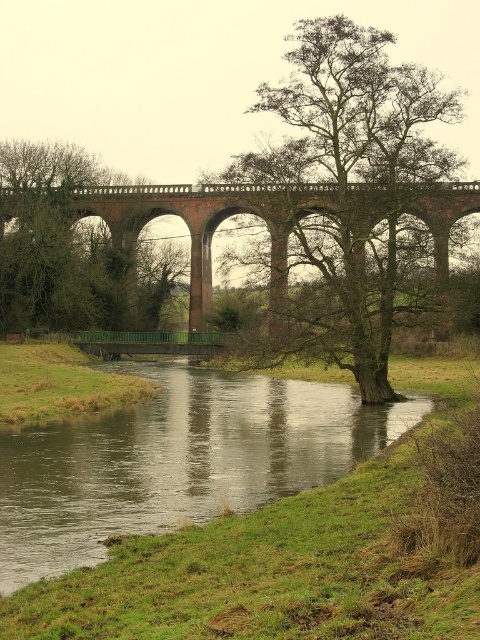
Question: Among these objects, which one is farthest from the camera?

Choices:
 (A) green leafy tree at center
 (B) brick arch bridge at center
 (C) green leafy tree at left
 (D) green grassy river at center

Answer: (C)

Question: Does green grassy river at center have a smaller size compared to brick arch bridge at center?

Choices:
 (A) no
 (B) yes

Answer: (B)

Question: Which point is farther to the camera?

Choices:
 (A) (400, 156)
 (B) (173, 269)
 (C) (361, 193)

Answer: (B)

Question: Which of these objects is positioned farthest from the brick arch bridge at center?

Choices:
 (A) green leafy tree at center
 (B) green leafy tree at left

Answer: (B)

Question: Is green grassy river at center wider than green leafy tree at center?

Choices:
 (A) yes
 (B) no

Answer: (A)

Question: Does green leafy tree at left have a lesser width compared to brick arch bridge at center?

Choices:
 (A) no
 (B) yes

Answer: (B)